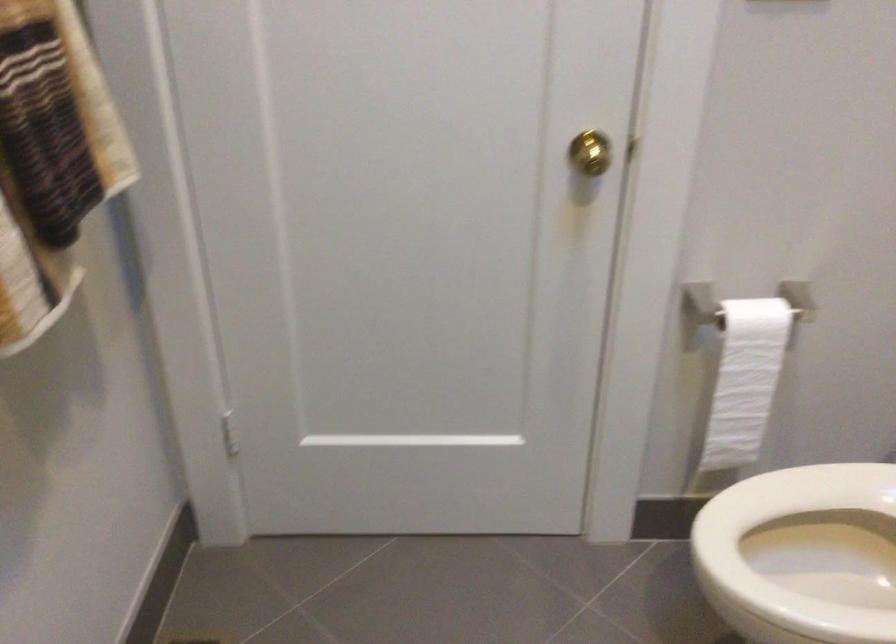
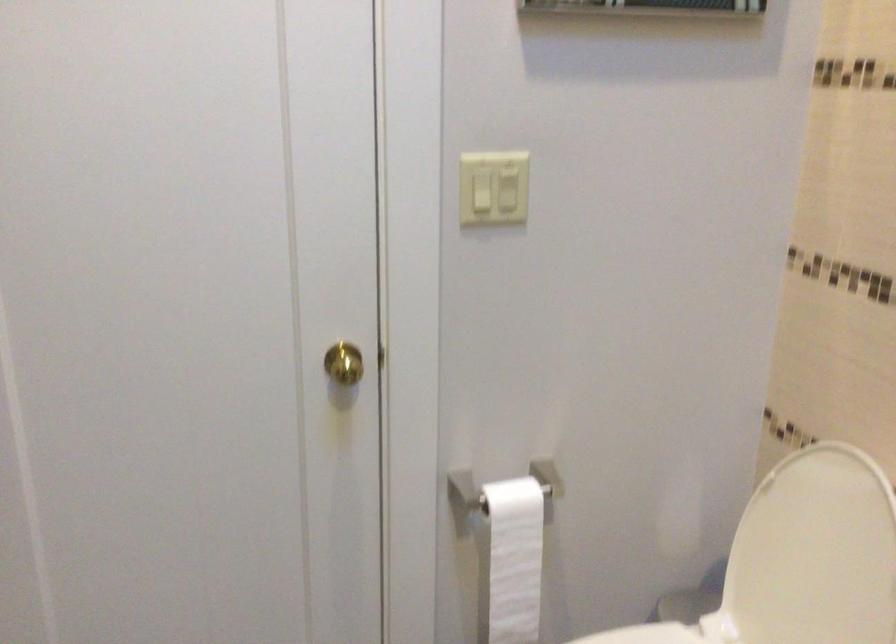
In the second image, find the point that corresponds to the point at 744,381 in the first image.

(513, 560)